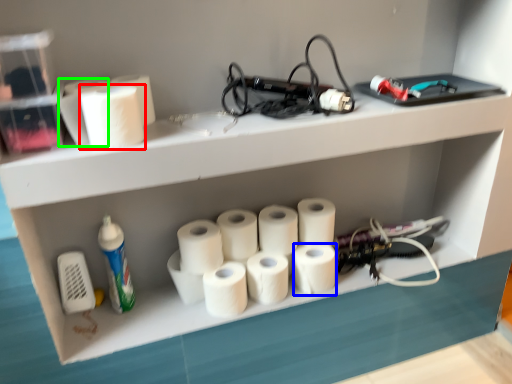
Question: Which is nearer to the paper towel (highlighted by a red box)? paper towel (highlighted by a blue box) or toilet paper (highlighted by a green box).

Choices:
 (A) paper towel
 (B) toilet paper

Answer: (B)